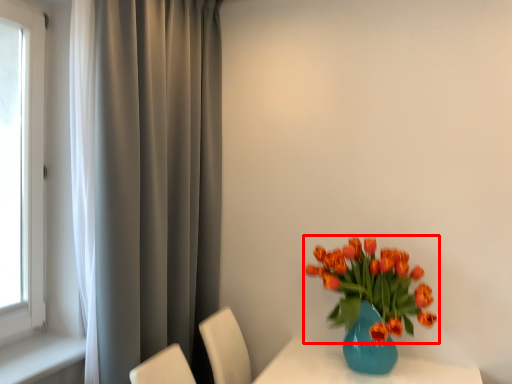
Question: Observing the image, what is the correct spatial positioning of flower (annotated by the red box) in reference to curtain?

Choices:
 (A) left
 (B) right

Answer: (B)